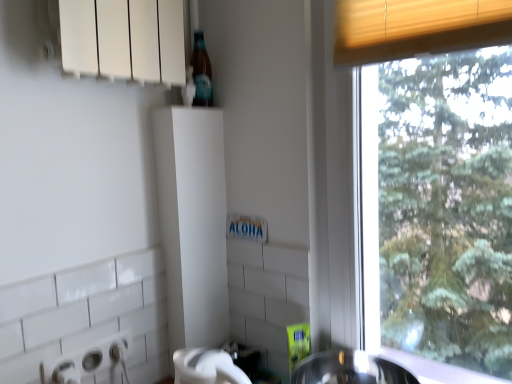
Question: Does translucent glass bottle at upper center have a larger size compared to white plastic bottle at upper center?

Choices:
 (A) yes
 (B) no

Answer: (B)

Question: Is translucent glass bottle at upper center at the left side of white plastic bottle at upper center?

Choices:
 (A) yes
 (B) no

Answer: (B)

Question: Considering the relative sizes of translucent glass bottle at upper center and white plastic bottle at upper center in the image provided, is translucent glass bottle at upper center taller than white plastic bottle at upper center?

Choices:
 (A) yes
 (B) no

Answer: (B)

Question: Is the depth of translucent glass bottle at upper center less than that of white plastic bottle at upper center?

Choices:
 (A) yes
 (B) no

Answer: (B)

Question: Is translucent glass bottle at upper center oriented away from white plastic bottle at upper center?

Choices:
 (A) yes
 (B) no

Answer: (A)

Question: Is translucent glass bottle at upper center with white plastic bottle at upper center?

Choices:
 (A) yes
 (B) no

Answer: (B)

Question: Does white plastic bottle at upper center have a lesser width compared to shiny metallic sink at lower center?

Choices:
 (A) yes
 (B) no

Answer: (A)

Question: Is white plastic bottle at upper center closer to the viewer compared to shiny metallic sink at lower center?

Choices:
 (A) no
 (B) yes

Answer: (B)

Question: Is white plastic bottle at upper center at the left side of shiny metallic sink at lower center?

Choices:
 (A) yes
 (B) no

Answer: (A)

Question: Can you confirm if white plastic bottle at upper center is bigger than shiny metallic sink at lower center?

Choices:
 (A) yes
 (B) no

Answer: (A)

Question: Are white plastic bottle at upper center and shiny metallic sink at lower center making contact?

Choices:
 (A) no
 (B) yes

Answer: (A)

Question: From a real-world perspective, is white plastic bottle at upper center on top of shiny metallic sink at lower center?

Choices:
 (A) no
 (B) yes

Answer: (B)

Question: Does white plastic bottle at upper center contain translucent glass bottle at upper center?

Choices:
 (A) yes
 (B) no

Answer: (A)